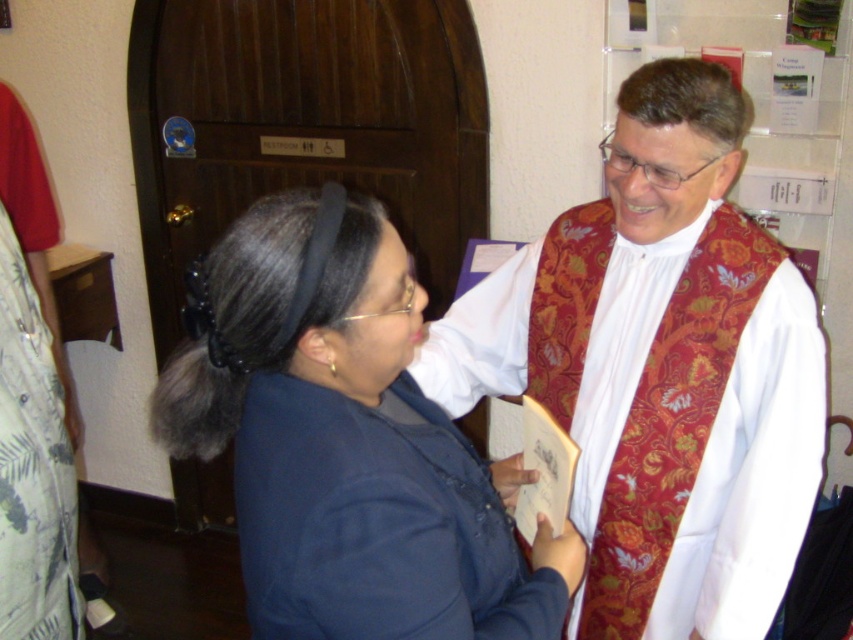
You are designing a display stand for a clothing store. The stand has two hangers. The first hanger can hold up to 1.2 kg, and the second can hold up to 1.5 kg. You need to hang the matte red vest at center and the printed cotton robe at left. Which item should go on which hanger to ensure safety?

The matte red vest at center is larger in size than the printed cotton robe at left, so it likely weighs more. To ensure safety, place the matte red vest at center on the second hanger that can hold up to 1.5 kg and the printed cotton robe at left on the first hanger with 1.2 kg capacity.

You are a photographer setting up for a group photo. You need to ensure that the matte red vest at center and the blue fabric robe at lower left are both visible in the frame. Based on their current positions, which object is closer to the camera?

The blue fabric robe at lower left is behind the matte red vest at center, so the matte red vest at center is closer to the camera.

From the picture: You are standing at the point with coordinates point [526,372] and want to move to the point with coordinates point [329,432]. Which direction should you move to reach your destination?

You should move forward because point [526,372] is behind point [329,432].